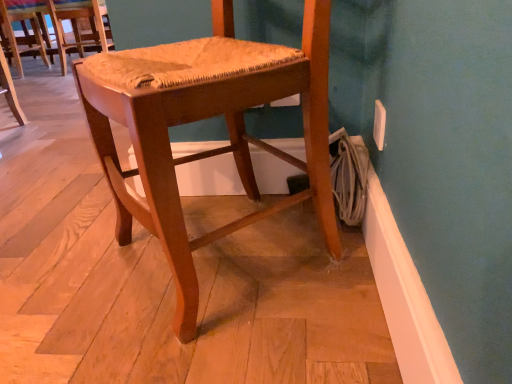
Question: Considering the positions of wooden woven seat at center, marked as the 1th chair in a front-to-back arrangement, and woven wood chair at center, which is counted as the 1th chair, starting from the back, in the image, is wooden woven seat at center, marked as the 1th chair in a front-to-back arrangement, taller or shorter than woven wood chair at center, which is counted as the 1th chair, starting from the back,?

Choices:
 (A) tall
 (B) short

Answer: (A)

Question: In the image, is wooden woven seat at center, the 2th chair from the left, on the left side or the right side of woven wood chair at center, which appears as the 2th chair when viewed from the right?

Choices:
 (A) left
 (B) right

Answer: (B)

Question: From a real-world perspective, relative to woven wood chair at center, which ranks as the 2th chair in front-to-back order, is wooden woven seat at center, the 1th chair in the right-to-left sequence, vertically above or below?

Choices:
 (A) below
 (B) above

Answer: (A)

Question: Considering the positions of point click(99, 18) and point click(126, 177), is point click(99, 18) closer or farther from the camera than point click(126, 177)?

Choices:
 (A) farther
 (B) closer

Answer: (A)

Question: Considering their positions, is woven wood chair at center, which is counted as the 1th chair, starting from the back, located in front of or behind wooden woven seat at center, marked as the second chair in a top-to-bottom arrangement?

Choices:
 (A) front
 (B) behind

Answer: (B)

Question: From a real-world perspective, relative to wooden woven seat at center, the 1th chair in the right-to-left sequence, is woven wood chair at center, arranged as the second chair when ordered from the bottom, vertically above or below?

Choices:
 (A) above
 (B) below

Answer: (A)

Question: Considering the positions of woven wood chair at center, which appears as the 2th chair when viewed from the right, and wooden woven seat at center, the 1th chair in the right-to-left sequence, in the image, is woven wood chair at center, which appears as the 2th chair when viewed from the right, bigger or smaller than wooden woven seat at center, the 1th chair in the right-to-left sequence,?

Choices:
 (A) small
 (B) big

Answer: (A)